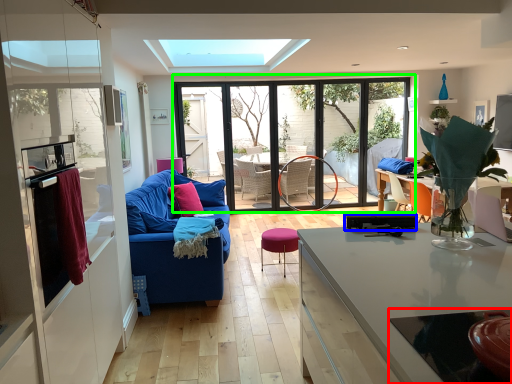
Question: Which is farther away from glass table (highlighted by a red box)? appliance (highlighted by a blue box) or window (highlighted by a green box)?

Choices:
 (A) appliance
 (B) window

Answer: (B)